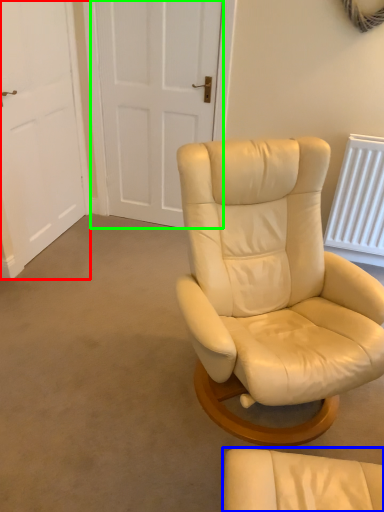
Question: Estimate the real-world distances between objects in this image. Which object is farther from door (highlighted by a red box), chair (highlighted by a blue box) or door (highlighted by a green box)?

Choices:
 (A) chair
 (B) door

Answer: (A)